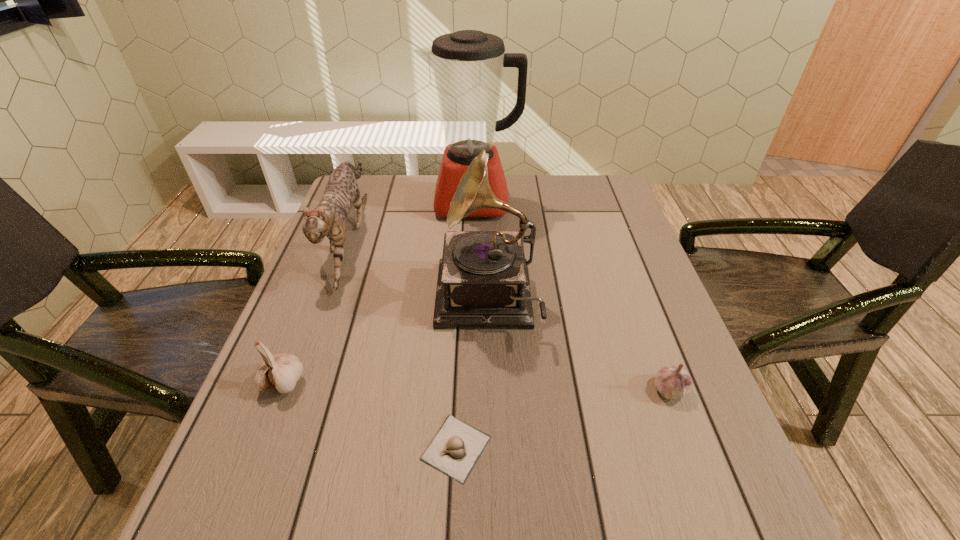
Identify the location of garlic situated at the left edge. Image resolution: width=960 pixels, height=540 pixels. (281, 371).

The width and height of the screenshot is (960, 540). What are the coordinates of `object at the right edge` in the screenshot? It's located at (673, 382).

I want to click on object that is at the far left corner, so click(328, 219).

Find the location of `vacant space at the far edge of the desktop`. vacant space at the far edge of the desktop is located at coordinates (412, 185).

Where is `blank space at the near edge`? The width and height of the screenshot is (960, 540). blank space at the near edge is located at coordinates (339, 533).

In the image, there is a desktop. At what (x,y) coordinates should I click in order to perform the action: click on vacant area at the left edge. Please return your answer as a coordinate pair (x, y). Looking at the image, I should click on (300, 438).

Image resolution: width=960 pixels, height=540 pixels. I want to click on vacant space at the right edge of the desktop, so click(x=708, y=446).

The height and width of the screenshot is (540, 960). Identify the location of vacant space at the far left corner of the desktop. (381, 196).

You are a GUI agent. You are given a task and a screenshot of the screen. Output one action in this format:
    pyautogui.click(x=<x>, y=<y>)
    Task: Click on the vacant area at the far right corner of the desktop
    The width and height of the screenshot is (960, 540).
    Given the screenshot: What is the action you would take?
    pyautogui.click(x=586, y=210)

Identify the location of vacant space at the near right corner. (674, 510).